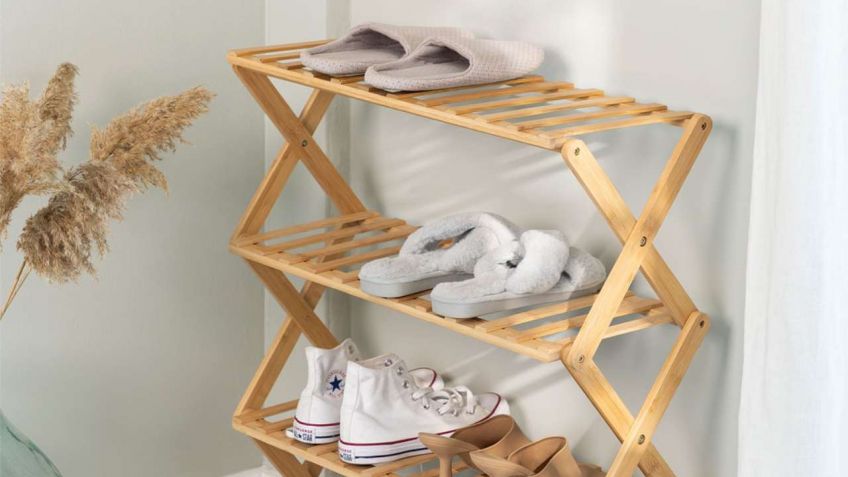
You are a GUI agent. You are given a task and a screenshot of the screen. Output one action in this format:
    pyautogui.click(x=<x>, y=<y>)
    Task: Click on the house slippers
    The width and height of the screenshot is (848, 477).
    Given the screenshot: What is the action you would take?
    [x=342, y=59], [x=410, y=71], [x=421, y=270], [x=497, y=281]